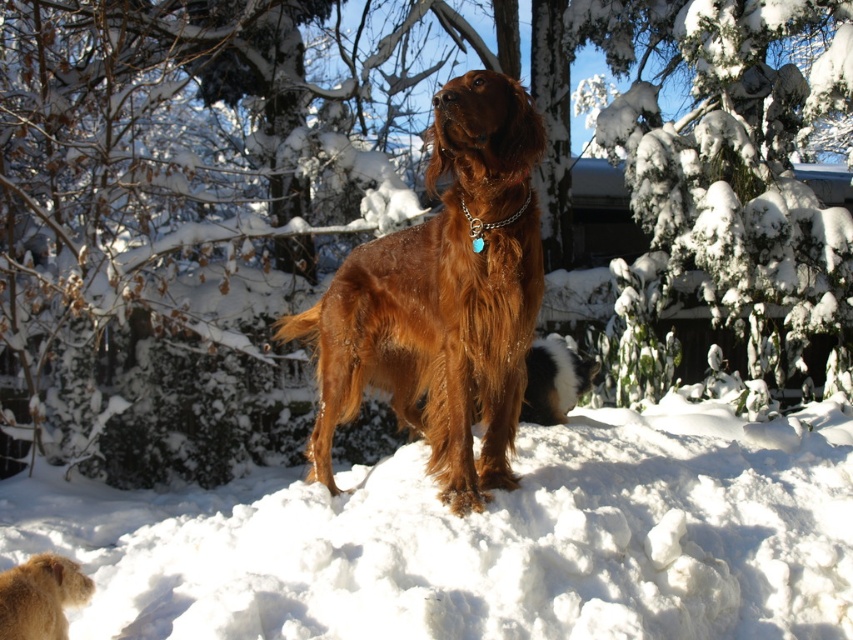
You are a photographer setting up a camera to capture both the brown furry dog at center and the golden fur dog at lower left in the same frame. Considering their positions and possible sizes, which dog should you focus on first to ensure both are in the frame?

You should focus on the brown furry dog at center first because it might be wider than the golden fur dog at lower left, so positioning the camera to include the wider dog ensures the narrower one is also captured.

You are a photographer trying to capture the perfect shot of the two points in the winter scene. Which point, point (x=593, y=12) or point (x=550, y=401), is closer to your camera lens?

Point (x=593, y=12) is further to the viewer than point (x=550, y=401), so the point closer to the camera lens is point (x=550, y=401).

You are a photographer standing in a snowy forest. You want to take a closeup photo of the brown furry dog at center. The camera you are using has a minimum focusing distance of 3 meters. Can you take the photo without moving closer?

The brown furry dog at center is 4.25 meters away from the camera. Since the minimum focusing distance is 3 meters, the camera can focus on the dog at 4.25 meters, so yes, you can take the closeup photo without moving closer.